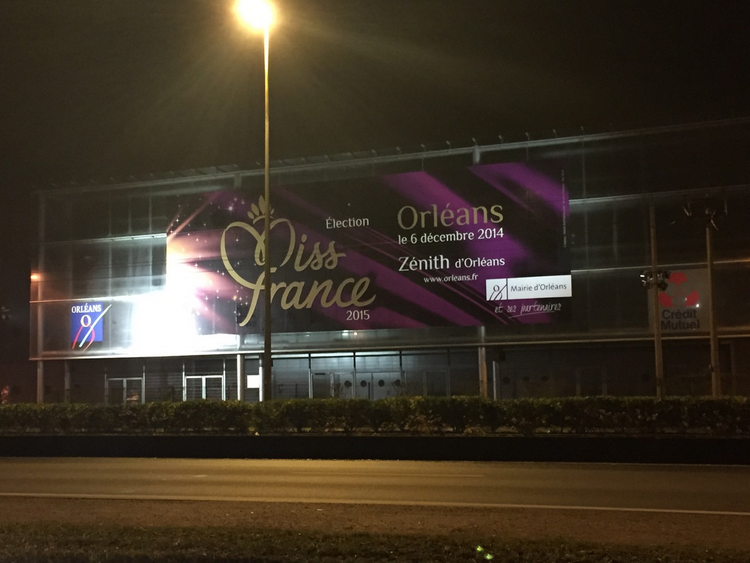
What are the coordinates of `poster` in the screenshot? It's located at coord(480,249).